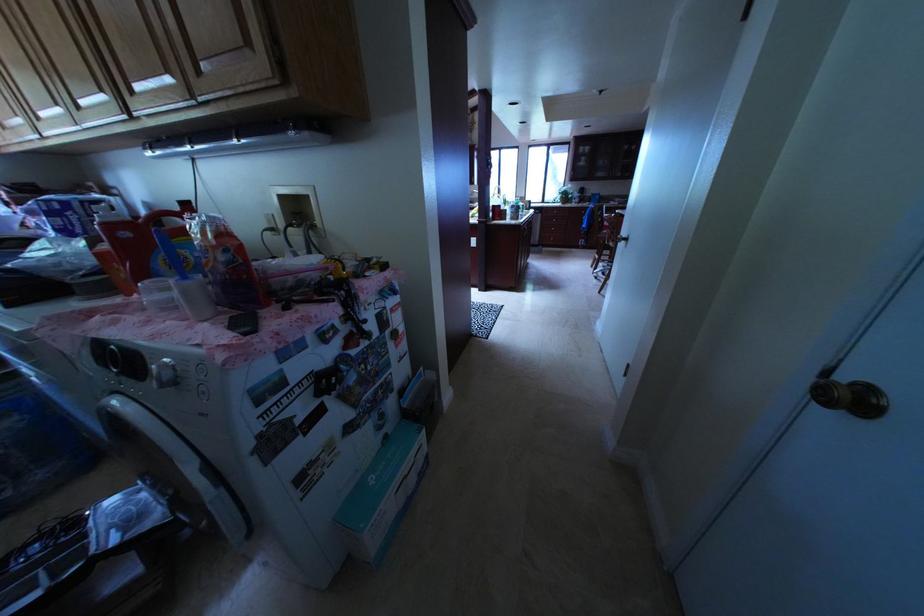
Find the location of `light blue box`. light blue box is located at coordinates (383, 493).